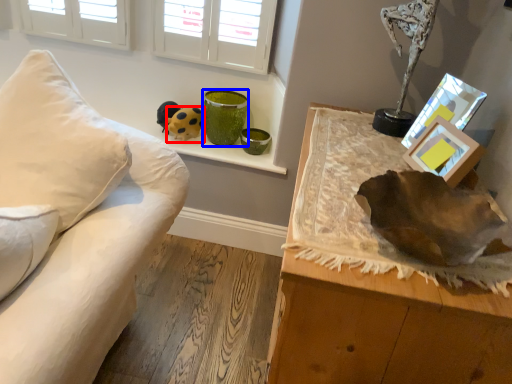
Question: Which object is further to the camera taking this photo, toy (highlighted by a red box) or vase (highlighted by a blue box)?

Choices:
 (A) toy
 (B) vase

Answer: (A)